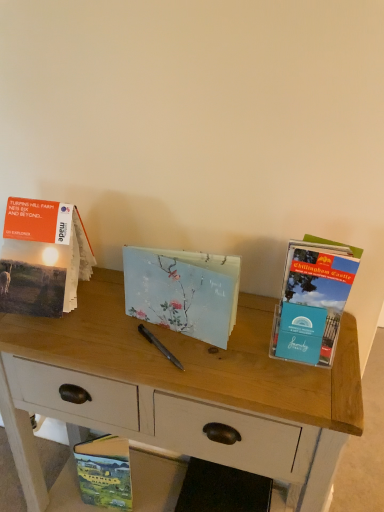
The image size is (384, 512). Find the location of `vacant space to the right of light blue textured notebook at center, the 2th book when ordered from right to left`. vacant space to the right of light blue textured notebook at center, the 2th book when ordered from right to left is located at coordinates (265, 350).